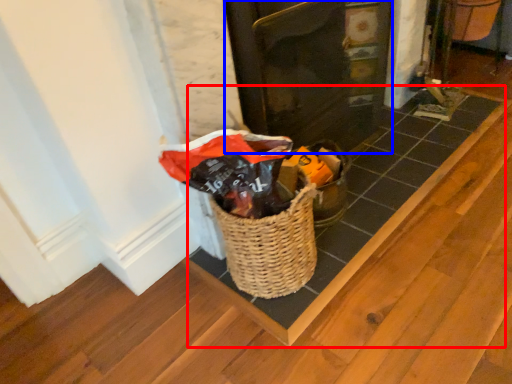
Question: Which point is further to the camera, plank (highlighted by a red box) or door (highlighted by a blue box)?

Choices:
 (A) plank
 (B) door

Answer: (A)